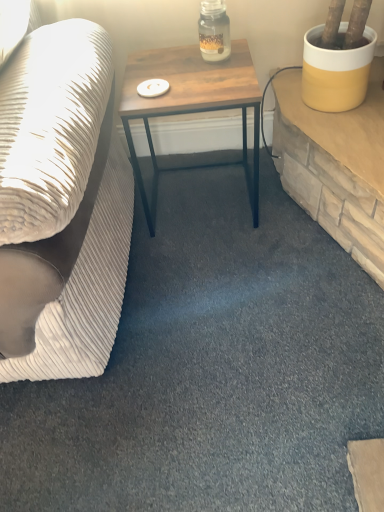
What are the coordinates of `free space in front of translucent glass jar at center` in the screenshot? It's located at (217, 84).